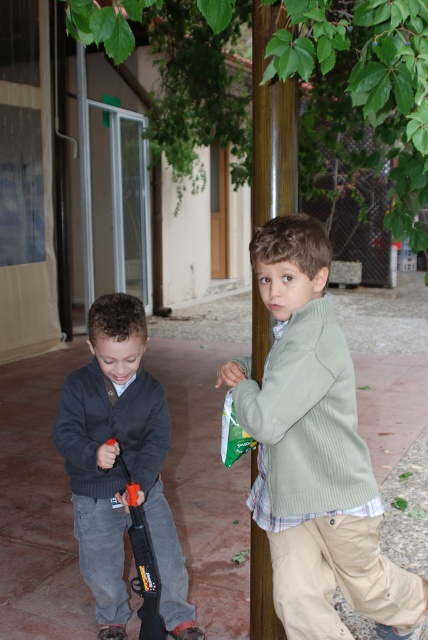
Is light green sweater at center to the right of brown wooden pole at center from the viewer's perspective?

Indeed, light green sweater at center is positioned on the right side of brown wooden pole at center.

Between light green sweater at center and brown wooden pole at center, which one appears on the left side from the viewer's perspective?

Positioned to the left is brown wooden pole at center.

Who is more distant from viewer, (x=332, y=464) or (x=282, y=192)?

Point (x=282, y=192)

Locate an element on the screen. The image size is (428, 640). light green sweater at center is located at coordinates (314, 451).

Between light green sweater at center and dark gray sweater at left, which one has more height?

light green sweater at center

The height and width of the screenshot is (640, 428). What do you see at coordinates (314, 451) in the screenshot?
I see `light green sweater at center` at bounding box center [314, 451].

The height and width of the screenshot is (640, 428). Identify the location of light green sweater at center. (314, 451).

Which is behind, point (318, 243) or point (143, 529)?

Point (143, 529)

What do you see at coordinates (314, 451) in the screenshot?
I see `light green sweater at center` at bounding box center [314, 451].

The width and height of the screenshot is (428, 640). Identify the location of light green sweater at center. (314, 451).